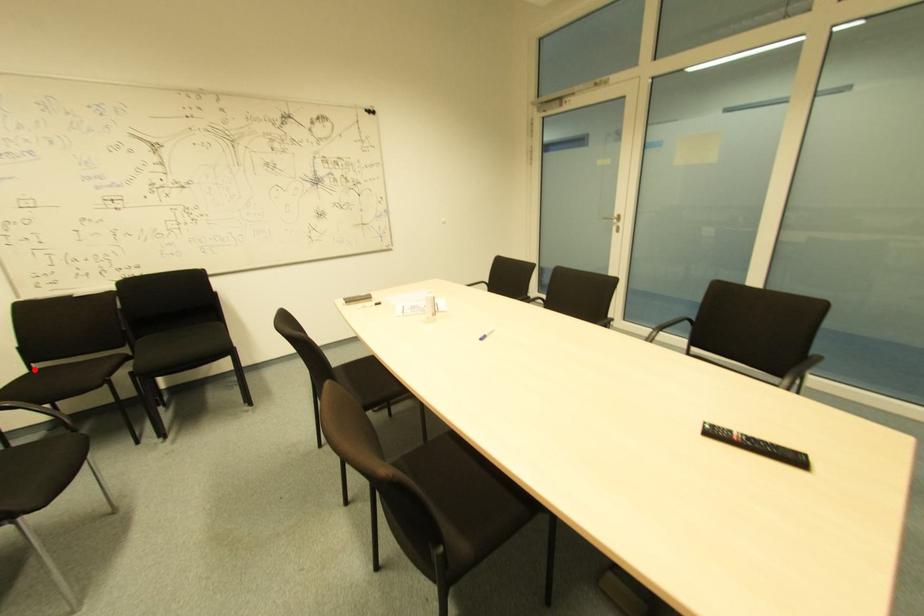
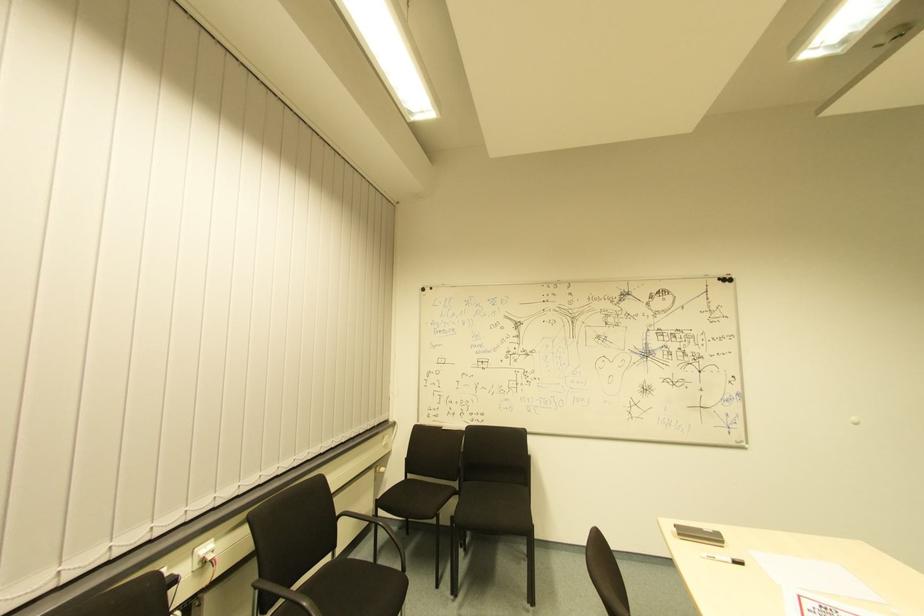
Question: I am providing you with two images of the same scene from different viewpoints. A red point is marked on the first image. At the location where the point appears in image 1, is it still visible in image 2?

Choices:
 (A) Yes
 (B) No

Answer: (A)